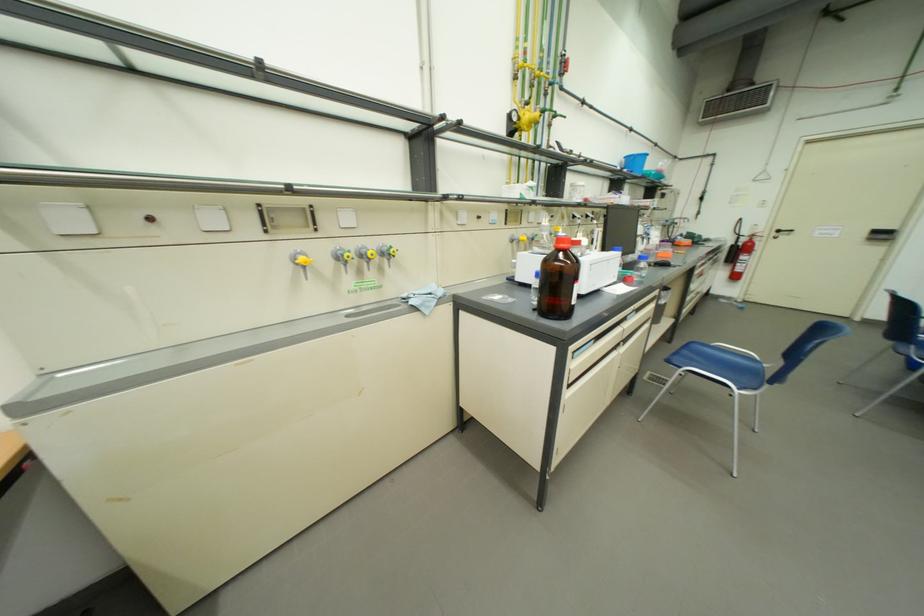
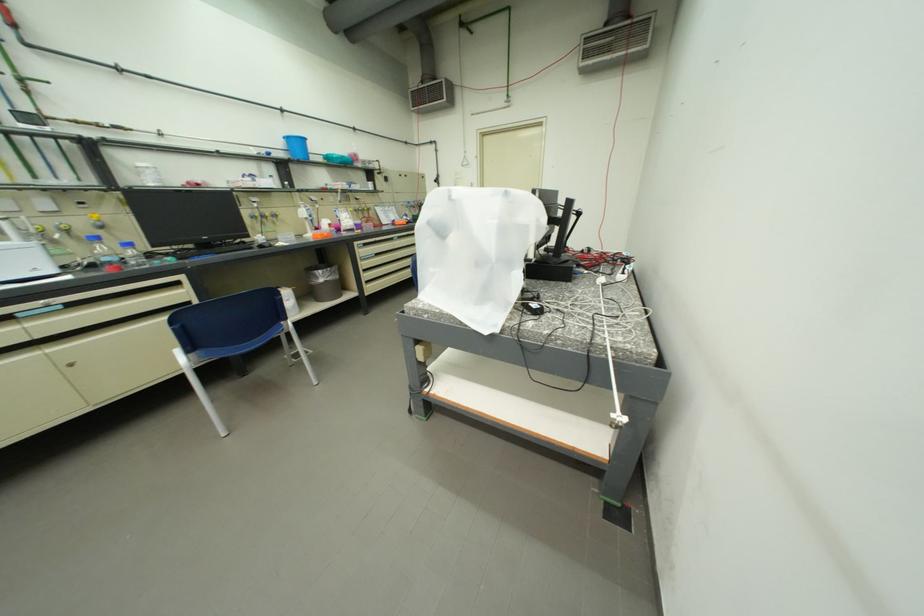
Question: The images are taken continuously from a first-person perspective. In which direction are you moving?

Choices:
 (A) Left
 (B) Right
 (C) Forward
 (D) Backward

Answer: (B)